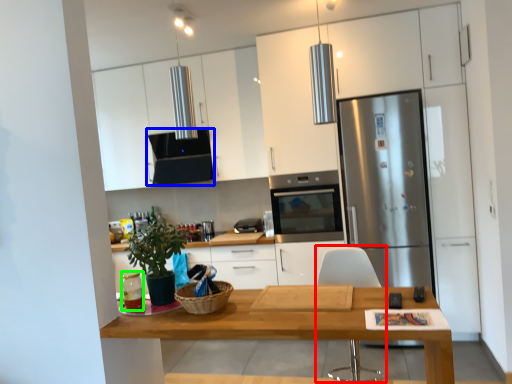
Question: Which is nearer to the chair (highlighted by a red box)? exhaust hood (highlighted by a blue box) or appliance (highlighted by a green box).

Choices:
 (A) exhaust hood
 (B) appliance

Answer: (B)